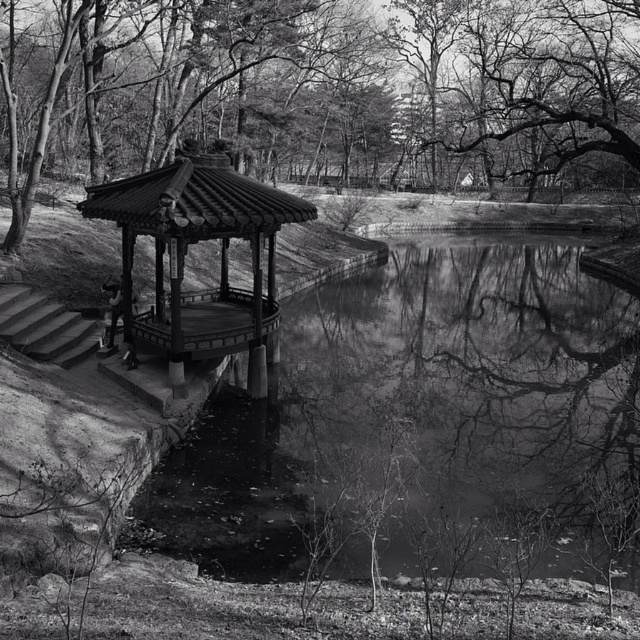
Question: Is the position of smooth bark tree at center more distant than that of wooden gazebo at center?

Choices:
 (A) yes
 (B) no

Answer: (A)

Question: Which object appears closest to the camera in this image?

Choices:
 (A) wooden gazebo at center
 (B) smooth bark tree at center

Answer: (A)

Question: Can you confirm if smooth bark tree at center is bigger than wooden gazebo at center?

Choices:
 (A) no
 (B) yes

Answer: (B)

Question: Which of the following is the farthest from the observer?

Choices:
 (A) [200, 224]
 (B) [540, 115]

Answer: (B)

Question: Which point is farther to the camera?

Choices:
 (A) (218, 115)
 (B) (269, 273)

Answer: (A)

Question: Is smooth bark tree at center wider than wooden gazebo at center?

Choices:
 (A) yes
 (B) no

Answer: (A)